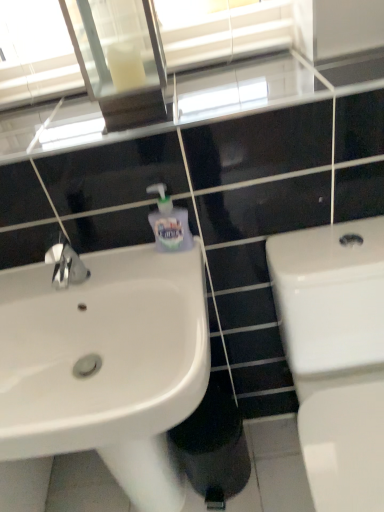
Question: Is translucent plastic soap dispenser at upper center positioned with its back to white glossy toilet at right?

Choices:
 (A) no
 (B) yes

Answer: (A)

Question: From the image's perspective, is translucent plastic soap dispenser at upper center below white glossy toilet at right?

Choices:
 (A) no
 (B) yes

Answer: (A)

Question: Could white glossy toilet at right be considered to be inside translucent plastic soap dispenser at upper center?

Choices:
 (A) no
 (B) yes

Answer: (A)

Question: Can you confirm if translucent plastic soap dispenser at upper center is shorter than white glossy toilet at right?

Choices:
 (A) yes
 (B) no

Answer: (A)

Question: Is translucent plastic soap dispenser at upper center further to the viewer compared to white glossy toilet at right?

Choices:
 (A) no
 (B) yes

Answer: (B)

Question: From a real-world perspective, is translucent plastic soap dispenser at upper center positioned above or below clear glass mirror at upper center?

Choices:
 (A) above
 (B) below

Answer: (B)

Question: From their relative heights in the image, would you say translucent plastic soap dispenser at upper center is taller or shorter than clear glass mirror at upper center?

Choices:
 (A) short
 (B) tall

Answer: (A)

Question: Would you say translucent plastic soap dispenser at upper center is inside or outside clear glass mirror at upper center?

Choices:
 (A) outside
 (B) inside

Answer: (A)

Question: Looking at their shapes, would you say translucent plastic soap dispenser at upper center is wider or thinner than clear glass mirror at upper center?

Choices:
 (A) thin
 (B) wide

Answer: (A)

Question: From a real-world perspective, is white glossy sink at left above or below clear glass mirror at upper center?

Choices:
 (A) above
 (B) below

Answer: (B)

Question: Is white glossy sink at left to the left or to the right of clear glass mirror at upper center in the image?

Choices:
 (A) right
 (B) left

Answer: (B)

Question: Considering the positions of white glossy sink at left and clear glass mirror at upper center in the image, is white glossy sink at left bigger or smaller than clear glass mirror at upper center?

Choices:
 (A) big
 (B) small

Answer: (A)

Question: From the image's perspective, is white glossy sink at left positioned above or below clear glass mirror at upper center?

Choices:
 (A) below
 (B) above

Answer: (A)

Question: Looking at the image, does white glossy toilet at right seem bigger or smaller compared to white glossy sink at left?

Choices:
 (A) big
 (B) small

Answer: (A)

Question: In terms of height, does white glossy toilet at right look taller or shorter compared to white glossy sink at left?

Choices:
 (A) tall
 (B) short

Answer: (A)